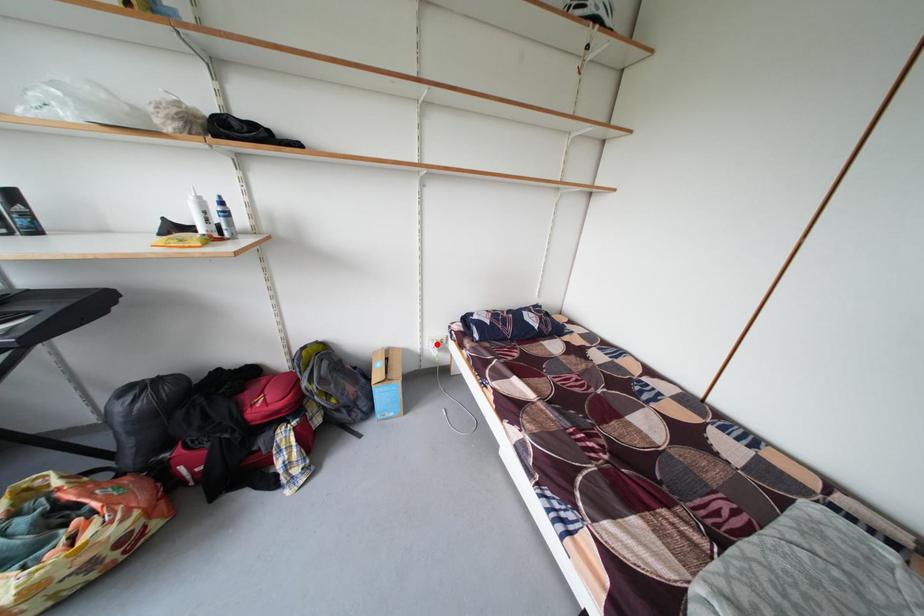
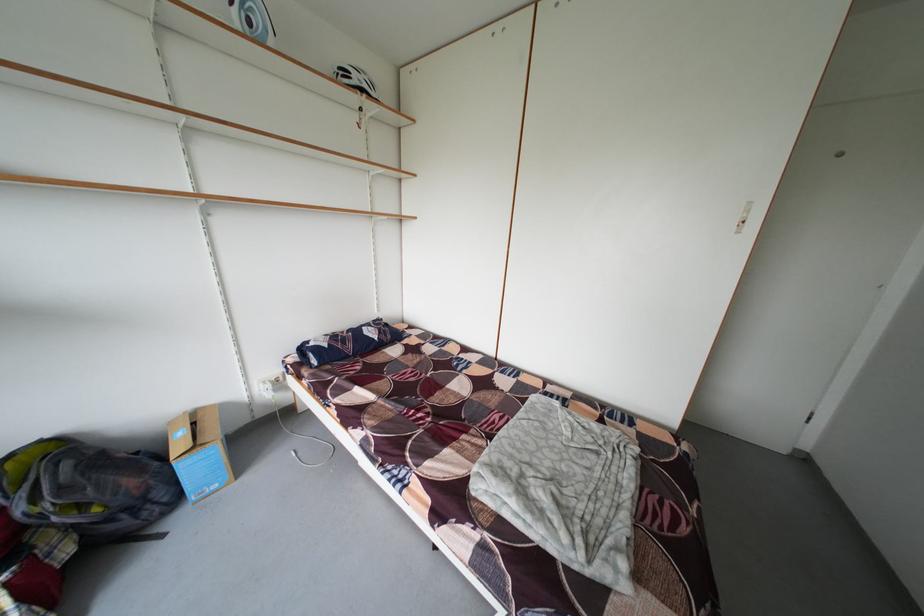
In the second image, find the point that corresponds to the highlighted location in the first image.

(265, 387)